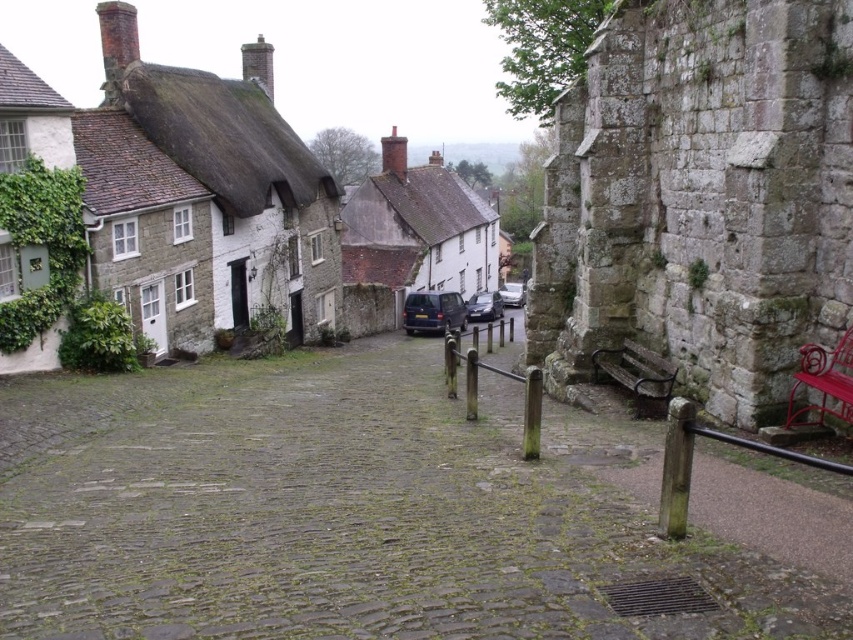
You are a delivery person carrying a large package that requires a path wider than the white matte cottage at center. Can you use the smooth cobblestone alley at center for your delivery route?

The smooth cobblestone alley at center is smaller than the white matte cottage at center, so it might not be wide enough to accommodate your large package. Consider finding an alternative route with a wider path.

You are a delivery driver trying to park your dark blue metallic van at center in front of the white matte cottage at center. Considering their widths, will the van fit completely in front of the cottage without overlapping?

The white matte cottage at center is wider than the dark blue metallic van at center. Therefore, the van will fit completely in front of the cottage without overlapping.